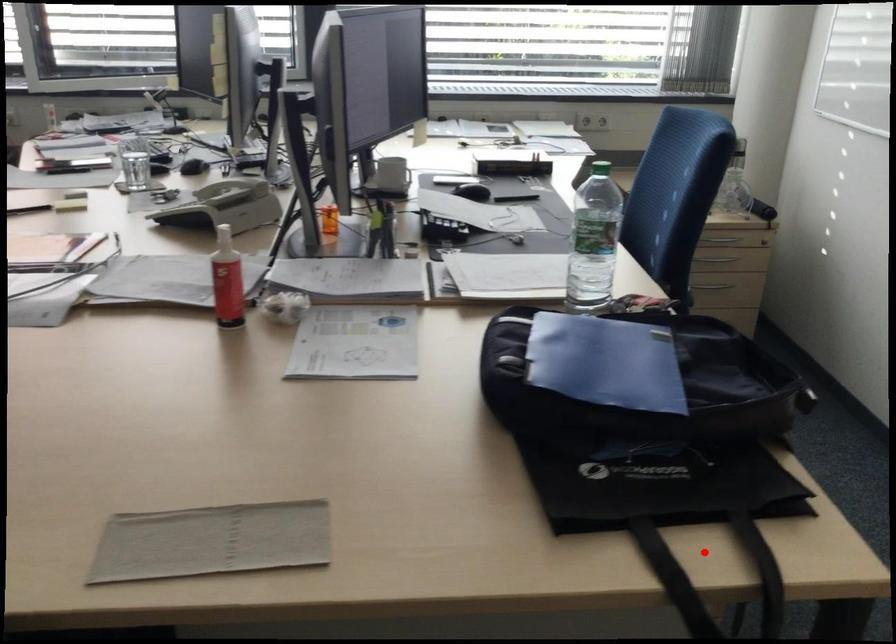
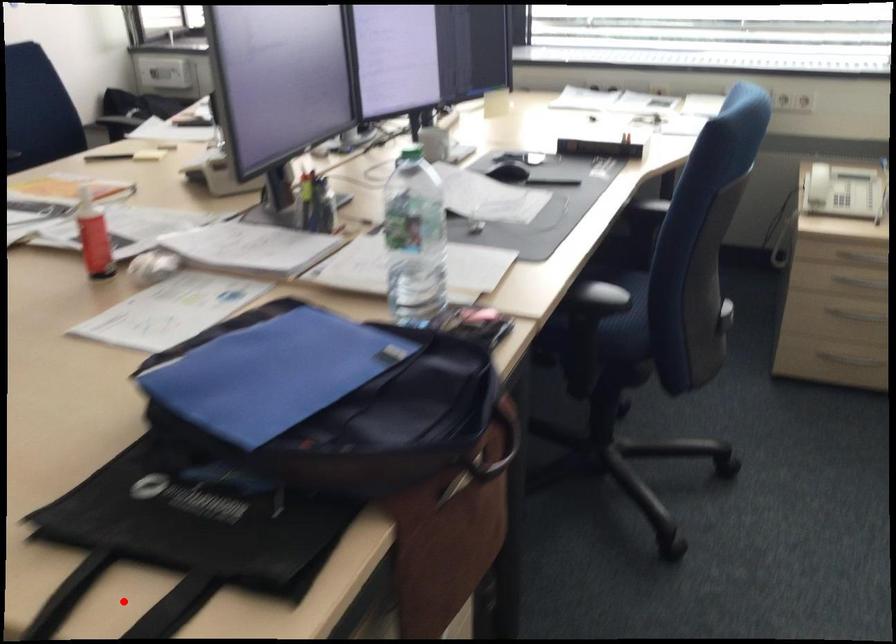
I am providing you with two images of the same scene from different viewpoints. A red point is marked on the first image and another point is marked on the second image. Is the red point in image1 aligned with the point shown in image2?

Yes